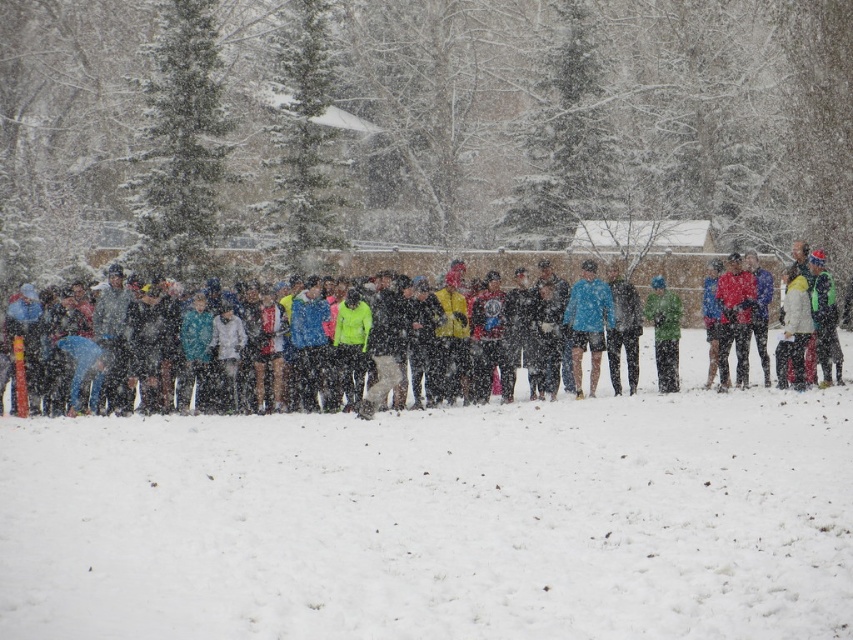
In the scene shown: You are standing in the snowy area and want to greet both the person wearing the blue matte jacket at center and the person in the matte red jacket at right. Which jacket wearer should you approach first to reach them in the shortest path?

You should approach the blue matte jacket at center first because it is closer to you than the matte red jacket at right, so the shortest path would be to the blue matte jacket at center.

You are a photographer standing at the edge of the snowy area, aiming to capture a group photo of the multicolored jackets at center and green fabric jacket at center. If your camera has a maximum focus range of 8 meters, will you be able to capture both subjects clearly in the same frame?

The distance between the multicolored jackets at center and the green fabric jacket at center is 8.93 meters. Since your camera can only focus up to 8 meters, you won t be able to capture both subjects clearly in the same frame as the distance exceeds the camera s maximum focus range.

You are standing at the edge of the snowy area and want to reach the green fabric jacket at center without stepping on the white fluffy snow at lower center. Is it possible? Please explain.

The white fluffy snow at lower center is 8.12 meters away from the green fabric jacket at center. Since the snow is at the lower center and the jacket is at the center, you can walk around the white fluffy snow at lower center to reach the green fabric jacket at center without stepping on it.